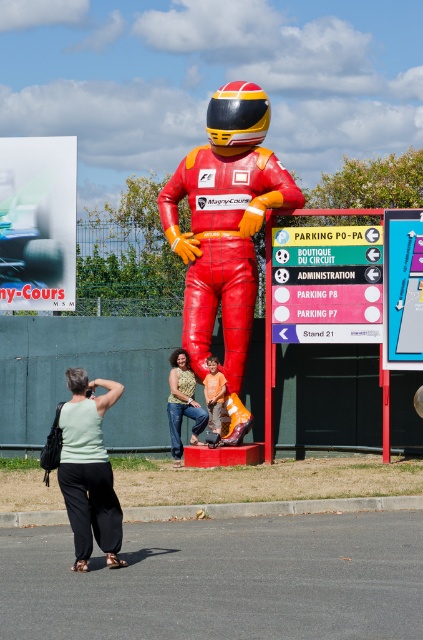
Question: Is metallic blue tire at upper left positioned at the back of jeans at center?

Choices:
 (A) no
 (B) yes

Answer: (B)

Question: Can you confirm if light green fabric shirt at lower left is wider than matte plastic sign at center?

Choices:
 (A) yes
 (B) no

Answer: (A)

Question: Which point is farther to the camera?

Choices:
 (A) metallic sign at center
 (B) shiny black helmet at center
 (C) metallic blue tire at upper left
 (D) jeans at center

Answer: (C)

Question: Which object is closer to the camera taking this photo?

Choices:
 (A) metallic blue tire at upper left
 (B) metallic sign at center

Answer: (B)

Question: Among these objects, which one is farthest from the camera?

Choices:
 (A) jeans at center
 (B) light green fabric shirt at lower left

Answer: (A)

Question: Can you confirm if metallic blue tire at upper left is positioned to the left of matte plastic sign at center?

Choices:
 (A) yes
 (B) no

Answer: (A)